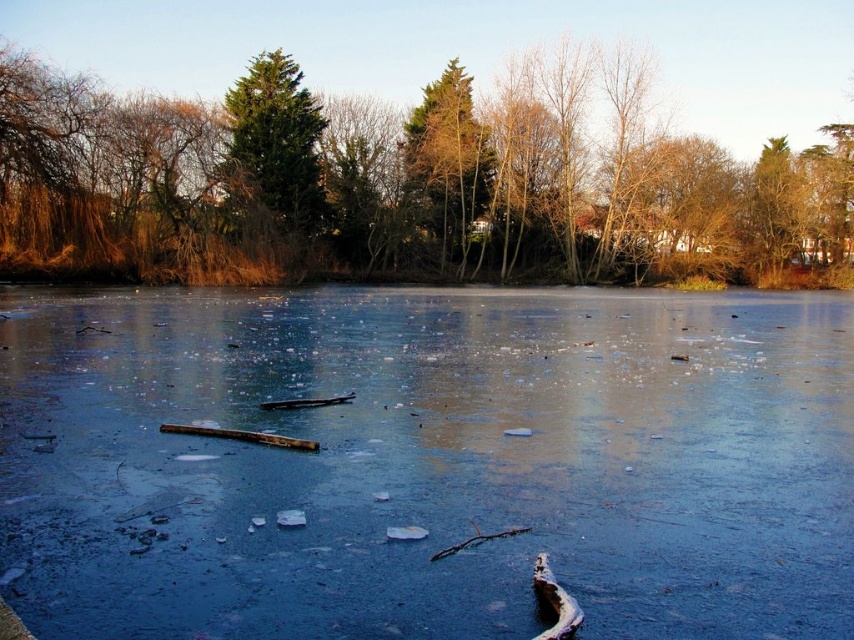
Question: Which point is closer to the camera taking this photo?

Choices:
 (A) (477, 244)
 (B) (171, 467)

Answer: (B)

Question: Estimate the real-world distances between objects in this image. Which object is farther from the translucent ice at center?

Choices:
 (A) green textured evergreen tree at upper center
 (B) green textured tree at upper center
 (C) green matte tree at center

Answer: (C)

Question: Which object appears closest to the camera in this image?

Choices:
 (A) green textured evergreen tree at upper center
 (B) translucent ice at center
 (C) green matte tree at center
 (D) green textured tree at upper center

Answer: (B)

Question: In this image, where is translucent ice at center located relative to green matte tree at center?

Choices:
 (A) below
 (B) above

Answer: (A)

Question: Does translucent ice at center appear on the left side of green textured evergreen tree at upper center?

Choices:
 (A) no
 (B) yes

Answer: (A)

Question: Does green textured tree at upper center have a lesser width compared to green textured evergreen tree at upper center?

Choices:
 (A) no
 (B) yes

Answer: (A)